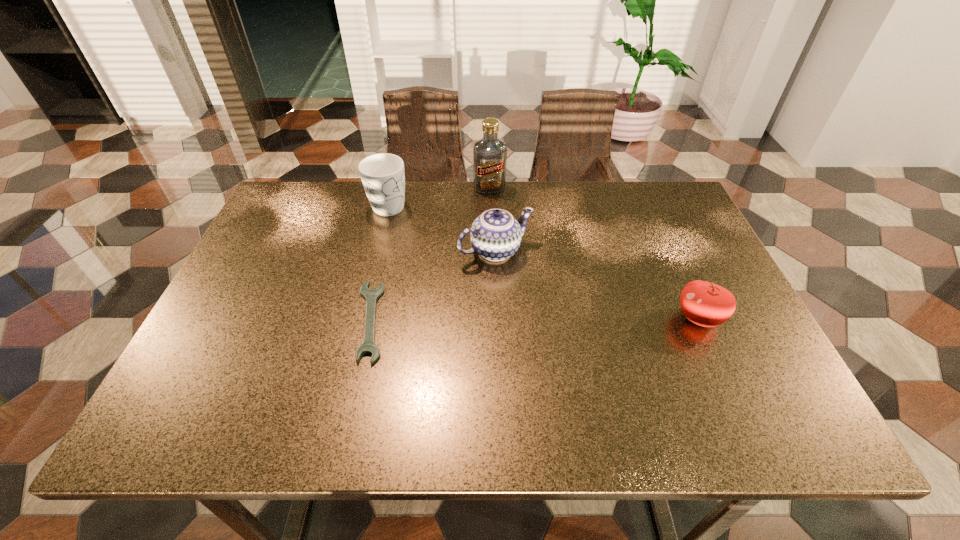
Where is `object that is at the right edge`? This screenshot has width=960, height=540. object that is at the right edge is located at coordinates (706, 304).

The height and width of the screenshot is (540, 960). In the image, there is a desktop. In order to click on free space at the far edge in this screenshot , I will do `click(545, 186)`.

In the image, there is a desktop. Find the location of `vacant area at the near edge`. vacant area at the near edge is located at coordinates (386, 355).

This screenshot has width=960, height=540. Identify the location of vacant position at the right edge of the desktop. (658, 245).

The height and width of the screenshot is (540, 960). In order to click on free spot at the near left corner of the desktop in this screenshot , I will do tap(189, 381).

This screenshot has height=540, width=960. I want to click on vacant space at the far right corner, so click(x=647, y=220).

Identify the location of unoccupied position between the chinaware and the mug. The width and height of the screenshot is (960, 540). (442, 228).

The height and width of the screenshot is (540, 960). Identify the location of free space between the wrench and the mug. (379, 263).

The image size is (960, 540). I want to click on vacant area between the chinaware and the fourth tallest object, so click(597, 285).

I want to click on vacant space that's between the mug and the shortest object, so click(379, 263).